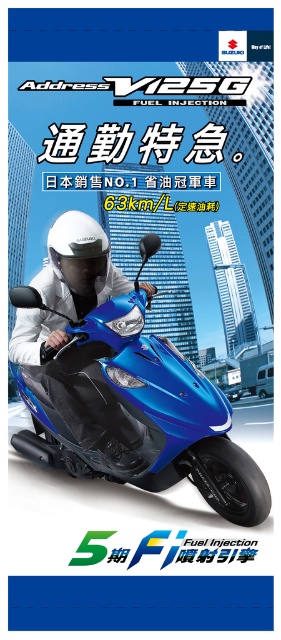
Question: Which of the following is the closest to the observer?

Choices:
 (A) matte blue helmet at upper left
 (B) glossy blue scooter at center

Answer: (B)

Question: Which object is closer to the camera taking this photo?

Choices:
 (A) glossy blue scooter at center
 (B) matte blue helmet at upper left

Answer: (A)

Question: Which point is closer to the camera taking this photo?

Choices:
 (A) (164, 394)
 (B) (98, 275)

Answer: (A)

Question: Does glossy blue scooter at center have a greater width compared to matte blue helmet at upper left?

Choices:
 (A) no
 (B) yes

Answer: (B)

Question: Considering the relative positions of glossy blue scooter at center and matte blue helmet at upper left in the image provided, where is glossy blue scooter at center located with respect to matte blue helmet at upper left?

Choices:
 (A) right
 (B) left

Answer: (B)

Question: Is glossy blue scooter at center wider than matte blue helmet at upper left?

Choices:
 (A) no
 (B) yes

Answer: (B)